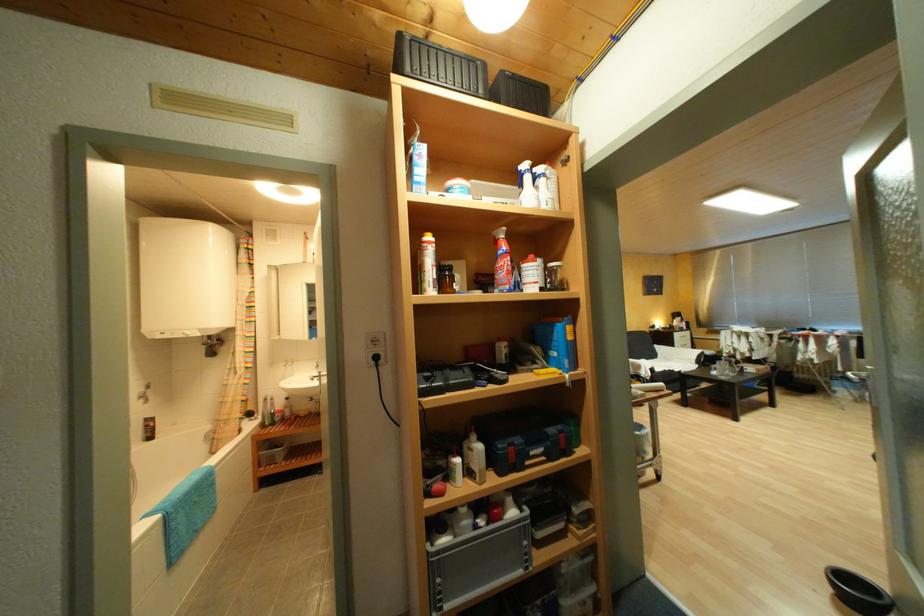
Where would you lift the blue toolbox handle? Please return your answer as a coordinate pair (x, y).

(537, 448)